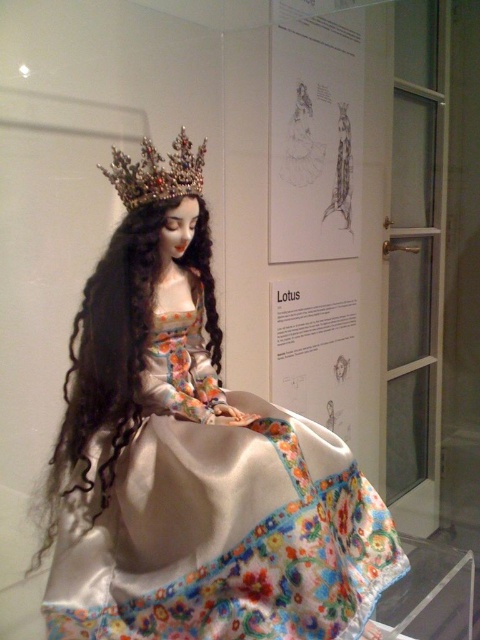
Question: Which of these objects is positioned farthest from the silky satin dress at center?

Choices:
 (A) sparkling gemstone crown at upper center
 (B) silky brown hair at center

Answer: (A)

Question: Does silky brown hair at center come in front of sparkling gemstone crown at upper center?

Choices:
 (A) no
 (B) yes

Answer: (B)

Question: Is silky satin dress at center behind silky brown hair at center?

Choices:
 (A) yes
 (B) no

Answer: (B)

Question: Estimate the real-world distances between objects in this image. Which object is farther from the silky satin dress at center?

Choices:
 (A) sparkling gemstone crown at upper center
 (B) silky brown hair at center

Answer: (A)

Question: Which point is closer to the camera?

Choices:
 (A) (205, 301)
 (B) (116, 595)

Answer: (B)

Question: Considering the relative positions of silky satin dress at center and sparkling gemstone crown at upper center in the image provided, where is silky satin dress at center located with respect to sparkling gemstone crown at upper center?

Choices:
 (A) below
 (B) above

Answer: (A)